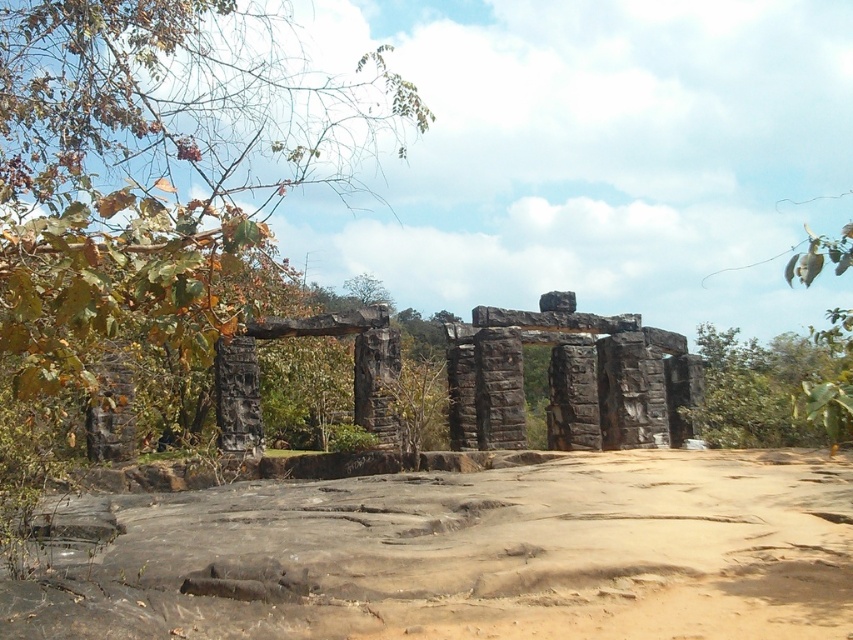
Is brown sandy dirt field at center positioned at the back of green leafy tree at center?

No, it is in front of green leafy tree at center.

Who is lower down, brown sandy dirt field at center or green leafy tree at center?

Positioned lower is brown sandy dirt field at center.

Identify the location of brown sandy dirt field at center. The image size is (853, 640). (469, 556).

I want to click on brown sandy dirt field at center, so click(x=469, y=556).

In the scene shown: Who is more distant from viewer, [677,422] or [718,401]?

The point [677,422] is more distant.

Does dark stone ruins at center lie in front of green leafy tree at center?

No, it is not.

I want to click on dark stone ruins at center, so click(x=569, y=378).

Can you confirm if brown sandy dirt field at center is smaller than green leafy tree at left?

Yes, brown sandy dirt field at center is smaller than green leafy tree at left.

How distant is brown sandy dirt field at center from green leafy tree at left?

The distance of brown sandy dirt field at center from green leafy tree at left is 29.24 meters.

In order to click on brown sandy dirt field at center in this screenshot , I will do `click(469, 556)`.

Identify the location of brown sandy dirt field at center. The height and width of the screenshot is (640, 853). (469, 556).